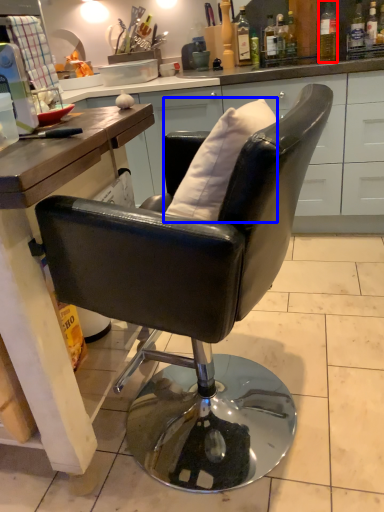
Question: Among these objects, which one is farthest to the camera, bottle (highlighted by a red box) or pillow (highlighted by a blue box)?

Choices:
 (A) bottle
 (B) pillow

Answer: (A)